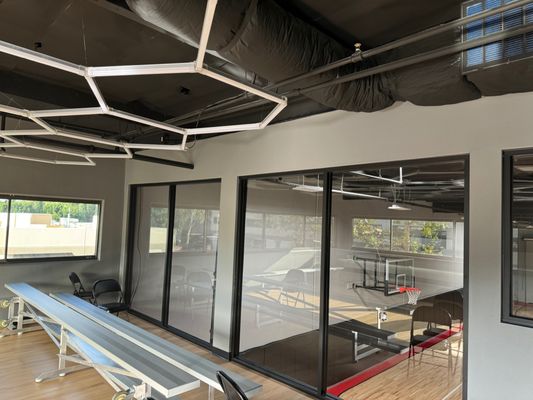
This screenshot has height=400, width=533. I want to click on circular vent, so click(300, 41).